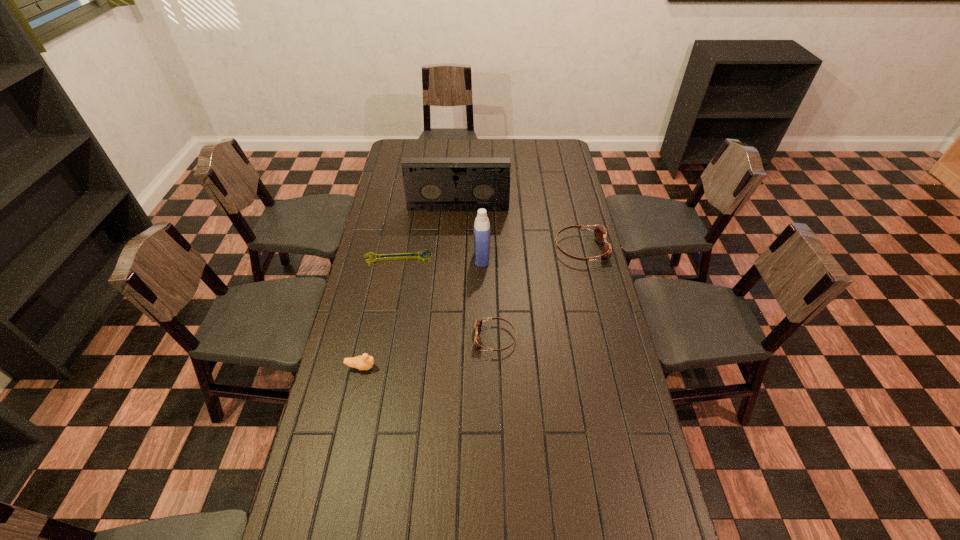
Identify the location of vacant space at the near edge. The height and width of the screenshot is (540, 960). (438, 505).

The width and height of the screenshot is (960, 540). In order to click on free space at the left edge of the desktop in this screenshot , I will do `click(388, 193)`.

In the image, there is a desktop. At what (x,y) coordinates should I click in order to perform the action: click on vacant region at the right edge. Please return your answer as a coordinate pair (x, y). The width and height of the screenshot is (960, 540). Looking at the image, I should click on (573, 170).

Find the location of a particular element. The height and width of the screenshot is (540, 960). blank space at the far left corner of the desktop is located at coordinates (395, 145).

Find the location of a particular element. vacant space at the far right corner is located at coordinates (564, 141).

Locate an element on the screen. free space between the duckling and the shortest object is located at coordinates (380, 312).

Find the location of a particular element. The image size is (960, 540). empty space between the wrench and the farthest object is located at coordinates (428, 233).

At what (x,y) coordinates should I click in order to perform the action: click on free space between the nearer goggles and the wrench. Please return your answer as a coordinate pair (x, y). The height and width of the screenshot is (540, 960). Looking at the image, I should click on (447, 298).

You are a GUI agent. You are given a task and a screenshot of the screen. Output one action in this format:
    pyautogui.click(x=<x>, y=<y>)
    Task: Click on the vacant space that is in between the shortest object and the videotape
    The width and height of the screenshot is (960, 540).
    Given the screenshot: What is the action you would take?
    pyautogui.click(x=428, y=233)

This screenshot has width=960, height=540. Identify the location of free space between the rightmost object and the wrench. (490, 253).